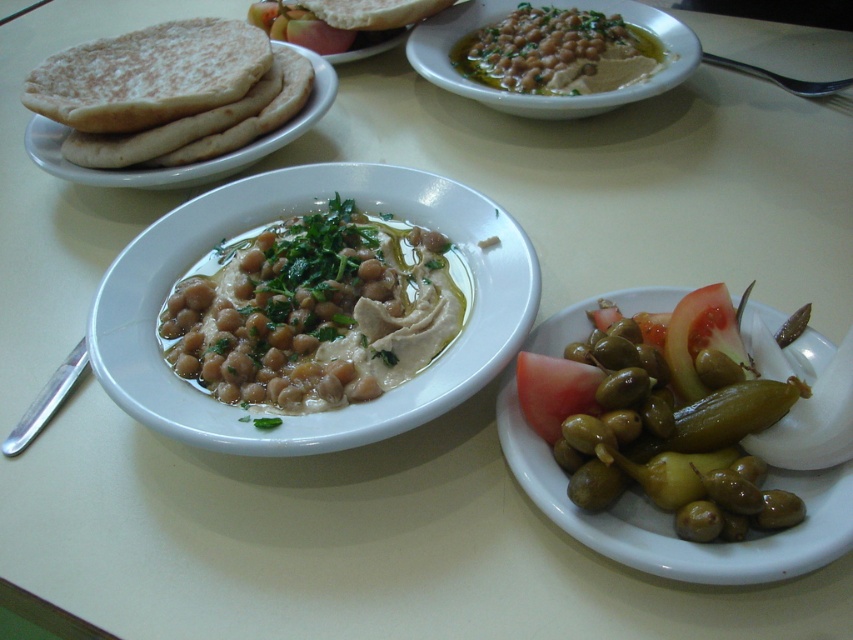
You are a food critic standing at the table. You need to reach for either the green glossy pickle at lower right or the green olive at center. Which one is farther from your current position?

The green glossy pickle at lower right is farther from your current position because it is 4.06 feet away from the green olive at center, which is closer.

You are a food photographer setting up a shot of the white flour tortilla at left. If your camera is positioned 1 meter away from the tortilla, will the tortilla be in focus?

The white flour tortilla at left is 1.24 meters away from the camera, so it will not be in focus since the camera is set at 1 meter distance.

You are a food critic who needs to compare the sizes of the green glossy pickle at lower right and the green olive at center. Which one is wider?

The green glossy pickle at lower right is narrower than the green olive at center, so the green olive at center is wider.